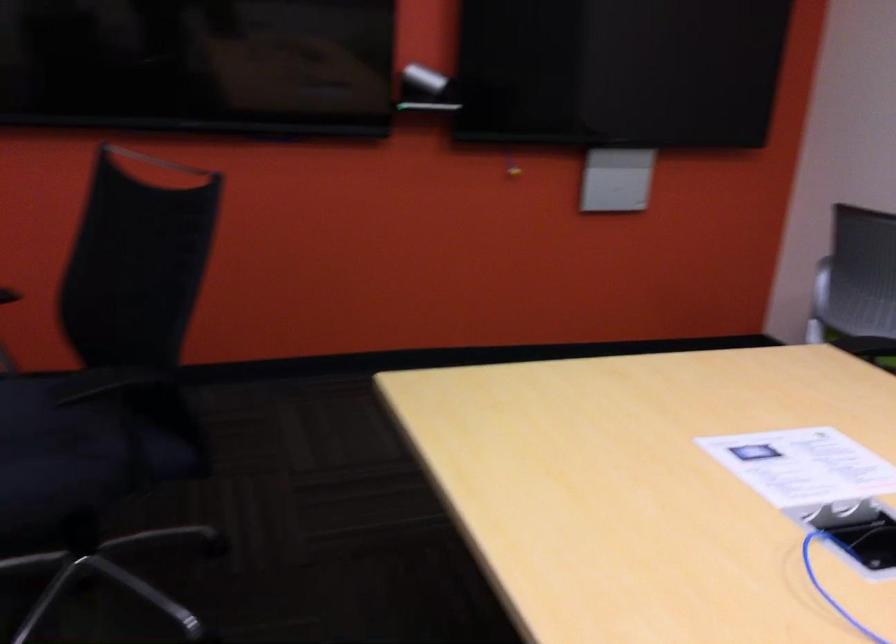
Locate an element on the screen. black chair sitting surface is located at coordinates (82, 450).